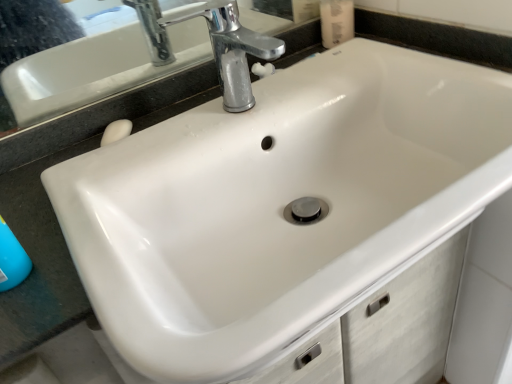
Find the location of a particular element. The image size is (512, 384). white matte bottle at upper right is located at coordinates (336, 21).

Describe the element at coordinates (336, 21) in the screenshot. I see `white matte bottle at upper right` at that location.

The width and height of the screenshot is (512, 384). I want to click on white matte bottle at upper right, so click(x=336, y=21).